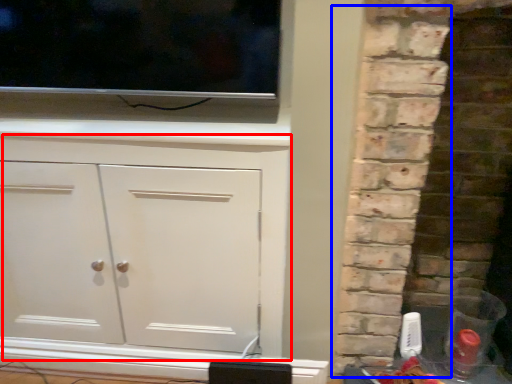
Question: Which point is closer to the camera, cupboard (highlighted by a red box) or brickwork (highlighted by a blue box)?

Choices:
 (A) cupboard
 (B) brickwork

Answer: (B)